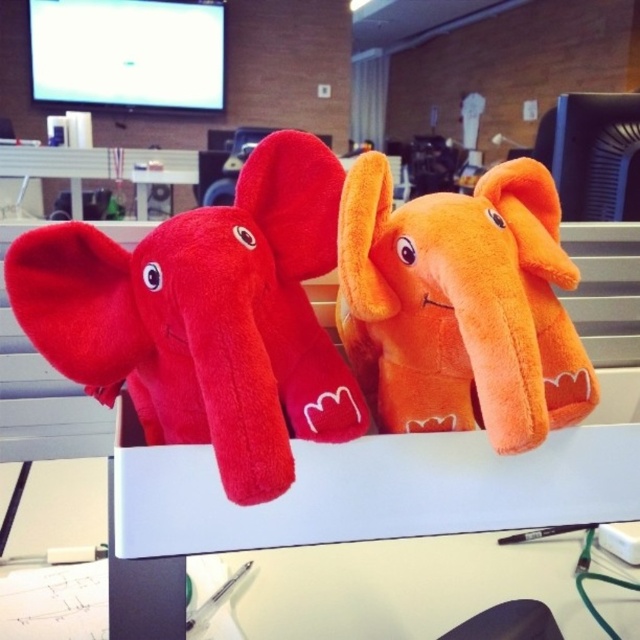
You are organizing a childrens party and have two elephant toys, the velvety red elephant at center and the orange plush elephant at center. You need to place them side by side on a shelf that can only hold items up to the width of the wider elephant. Which elephant should you use to determine the maximum width for the shelf?

The velvety red elephant at center is wider than the orange plush elephant at center. Therefore, you should use the velvety red elephant at center to determine the maximum width for the shelf since it is the wider of the two.